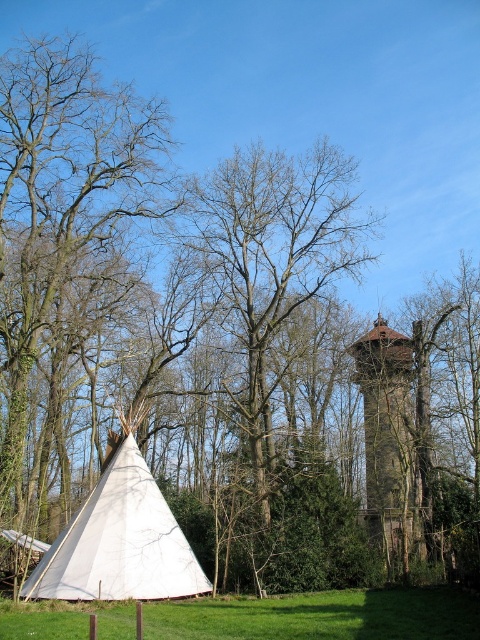
Describe the element at coordinates (62, 250) in the screenshot. I see `smooth bark tree at left` at that location.

Is smooth bark tree at left below white canvas tent at lower left?

Actually, smooth bark tree at left is above white canvas tent at lower left.

The height and width of the screenshot is (640, 480). Identify the location of smooth bark tree at left. (62, 250).

Between bare wood tree at center and white canvas tent at lower left, which one has more height?

bare wood tree at center is taller.

Is point (321, 202) more distant than point (95, 573)?

Yes, it is behind point (95, 573).

You are a GUI agent. You are given a task and a screenshot of the screen. Output one action in this format:
    pyautogui.click(x=<x>, y=<y>)
    Task: Click on the bare wood tree at center
    The image size is (480, 640).
    Given the screenshot: What is the action you would take?
    point(275,266)

Can you confirm if smooth bark tree at left is taller than green grass at lower left?

Correct, smooth bark tree at left is much taller as green grass at lower left.

At what (x,y) coordinates should I click in order to perform the action: click on smooth bark tree at left. Please return your answer as a coordinate pair (x, y). Looking at the image, I should click on (62, 250).

Locate an element on the screen. Image resolution: width=480 pixels, height=640 pixels. smooth bark tree at left is located at coordinates (62, 250).